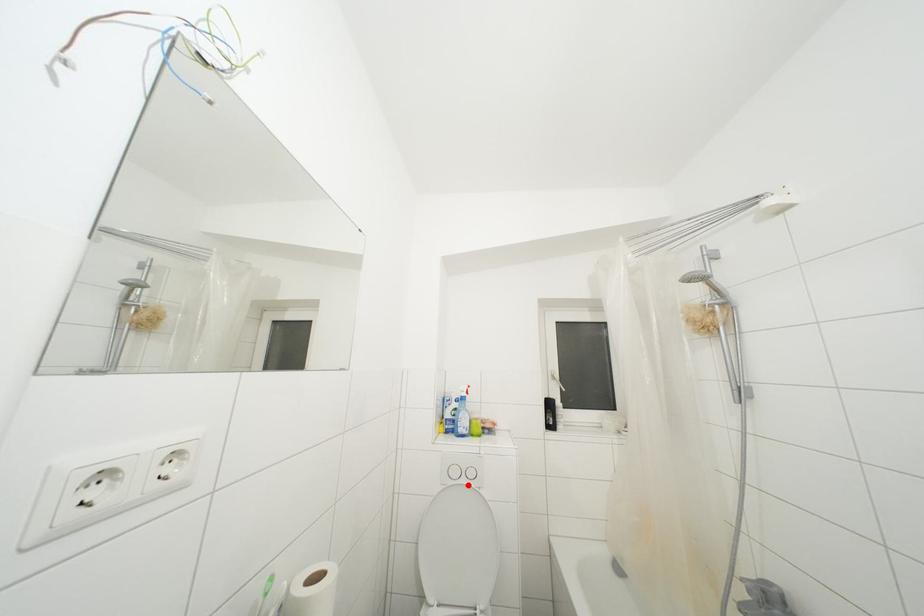
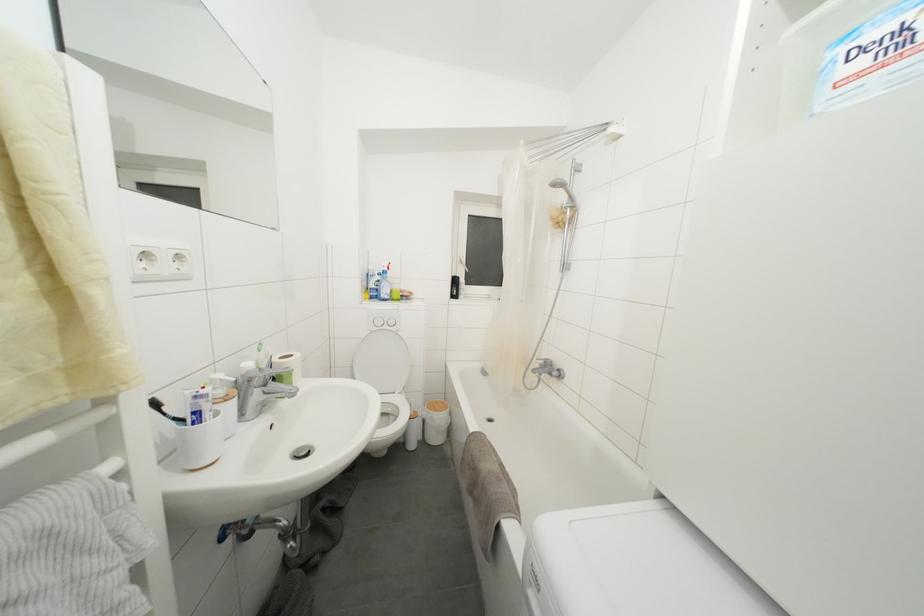
Question: I am providing you with two images of the same scene from different viewpoints. In image1, a red point is highlighted. Considering the same 3D point in image2, which of the following is correct?

Choices:
 (A) It is closer
 (B) It is farther

Answer: (A)